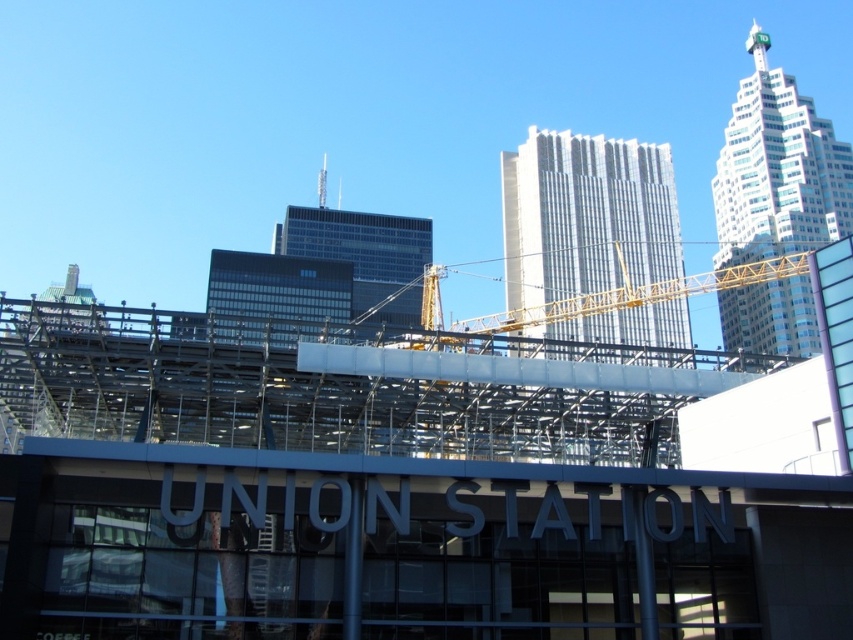
Question: Which point appears closest to the camera in this image?

Choices:
 (A) (554, 136)
 (B) (375, 305)
 (C) (776, 252)

Answer: (A)

Question: Does white glass skyscraper at upper right have a larger size compared to glassy black skyscraper at center?

Choices:
 (A) no
 (B) yes

Answer: (A)

Question: Which is farther from the yellow metallic crane at center?

Choices:
 (A) white glass skyscraper at upper right
 (B) glassy black skyscraper at center

Answer: (A)

Question: Is white glass skyscraper at upper right behind yellow metallic crane at center?

Choices:
 (A) no
 (B) yes

Answer: (B)

Question: Is white glass skyscraper at upper right above glassy black skyscraper at center?

Choices:
 (A) yes
 (B) no

Answer: (A)

Question: Among these points, which one is farthest from the camera?

Choices:
 (A) (393, 269)
 (B) (543, 173)

Answer: (A)